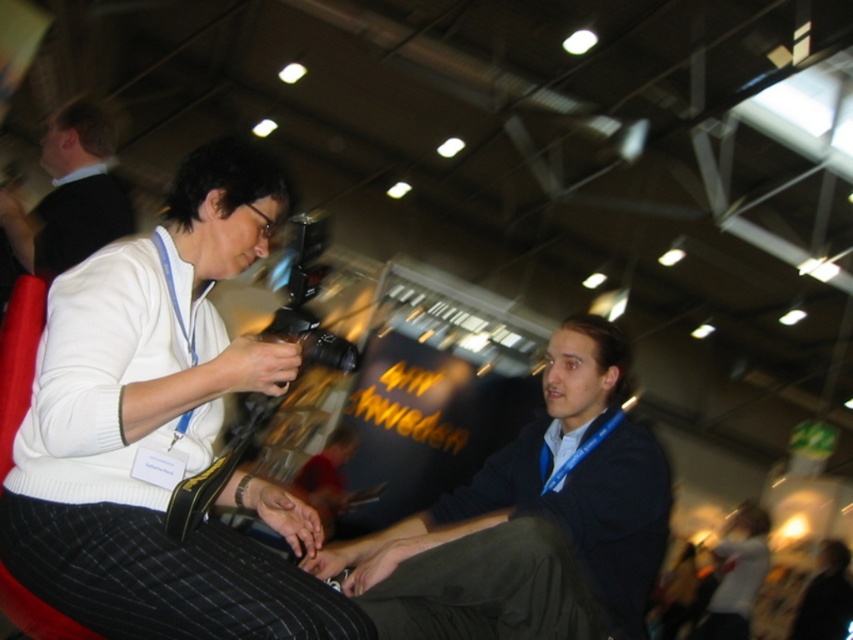
Can you confirm if white matte sweater at upper left is bigger than black shirt at upper left?

Indeed, white matte sweater at upper left has a larger size compared to black shirt at upper left.

Is white matte sweater at upper left further to the viewer compared to black shirt at upper left?

No, white matte sweater at upper left is closer to the viewer.

Is point (96, 333) farther from camera compared to point (96, 132)?

No.

You are a GUI agent. You are given a task and a screenshot of the screen. Output one action in this format:
    pyautogui.click(x=<x>, y=<y>)
    Task: Click on the white matte sweater at upper left
    This screenshot has width=853, height=640.
    Given the screenshot: What is the action you would take?
    pyautogui.click(x=155, y=428)

Does white matte sweater at upper left have a greater height compared to dark blue sweater at center?

Indeed, white matte sweater at upper left has a greater height compared to dark blue sweater at center.

Can you confirm if white matte sweater at upper left is positioned below dark blue sweater at center?

Actually, white matte sweater at upper left is above dark blue sweater at center.

Is point (293, 628) closer to viewer compared to point (595, 352)?

That is True.

Locate an element on the screen. white matte sweater at upper left is located at coordinates (155, 428).

Does dark blue sweater at center appear over black shirt at upper left?

Incorrect, dark blue sweater at center is not positioned above black shirt at upper left.

Does point (589, 433) come in front of point (49, 259)?

Yes, it is in front of point (49, 259).

In order to click on dark blue sweater at center in this screenshot , I will do `click(529, 522)`.